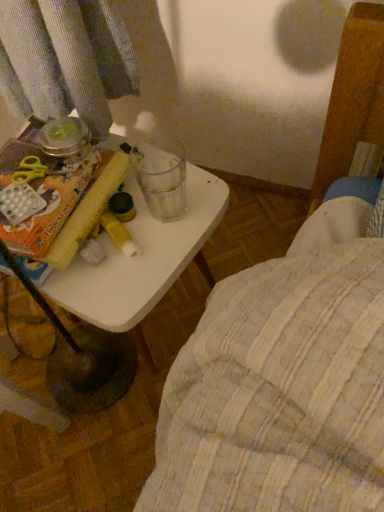
This screenshot has width=384, height=512. Identify the location of free space above yellow paper at left (from a real-world perspective). (37, 179).